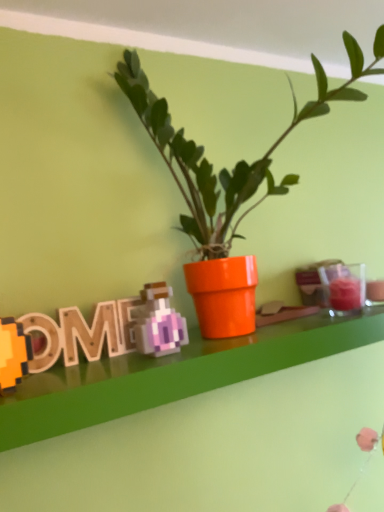
Find the location of a particular element. This screenshot has width=384, height=512. orange glossy pot at center is located at coordinates (239, 161).

This screenshot has height=512, width=384. What do you see at coordinates (239, 161) in the screenshot?
I see `orange glossy pot at center` at bounding box center [239, 161].

You are a GUI agent. You are given a task and a screenshot of the screen. Output one action in this format:
    pyautogui.click(x=<x>, y=<y>)
    Task: Click on the wooden pixelated letter at left
    This screenshot has width=384, height=512.
    Given the screenshot: What is the action you would take?
    pyautogui.click(x=82, y=333)

What do you see at coordinates (82, 333) in the screenshot?
I see `wooden pixelated letter at left` at bounding box center [82, 333].

Locate an element on the screen. This screenshot has height=512, width=384. orange glossy pot at center is located at coordinates 239,161.

Between orange glossy pot at center and wooden pixelated letter at left, which one appears on the left side from the viewer's perspective?

Positioned to the left is wooden pixelated letter at left.

Considering their positions, is orange glossy pot at center located in front of or behind wooden pixelated letter at left?

Clearly, orange glossy pot at center is in front of wooden pixelated letter at left.

Which point is more distant from viewer, (x=163, y=142) or (x=42, y=328)?

Point (x=163, y=142)

From the picture: From the image's perspective, who appears lower, orange glossy pot at center or wooden pixelated letter at left?

wooden pixelated letter at left is shown below in the image.

From a real-world perspective, is orange glossy pot at center positioned above or below wooden pixelated letter at left?

orange glossy pot at center is situated higher than wooden pixelated letter at left in the real world.

Which object is thinner, orange glossy pot at center or wooden pixelated letter at left?

wooden pixelated letter at left.

Which of these two, orange glossy pot at center or wooden pixelated letter at left, stands taller?

Standing taller between the two is orange glossy pot at center.

Which of these two, orange glossy pot at center or wooden pixelated letter at left, is smaller?

Smaller between the two is wooden pixelated letter at left.

Is orange glossy pot at center located outside wooden pixelated letter at left?

That's correct, orange glossy pot at center is outside of wooden pixelated letter at left.

Is orange glossy pot at center not close to wooden pixelated letter at left?

No, orange glossy pot at center is in close proximity to wooden pixelated letter at left.

Could you tell me if orange glossy pot at center is facing wooden pixelated letter at left?

No, orange glossy pot at center does not turn towards wooden pixelated letter at left.

How many degrees apart are the facing directions of orange glossy pot at center and wooden pixelated letter at left?

0.00119 degrees.

Find the location of `houseplant located in front of the wooden pixelated letter at left`. houseplant located in front of the wooden pixelated letter at left is located at coordinates (239, 161).

Does wooden pixelated letter at left appear on the left side of orange glossy pot at center?

Indeed, wooden pixelated letter at left is positioned on the left side of orange glossy pot at center.

Which is behind, wooden pixelated letter at left or orange glossy pot at center?

Positioned behind is wooden pixelated letter at left.

Which point is more distant from viewer, (78, 313) or (166, 114)?

The point (166, 114) is farther from the camera.

From the image's perspective, who appears lower, wooden pixelated letter at left or orange glossy pot at center?

wooden pixelated letter at left is shown below in the image.

From a real-world perspective, is wooden pixelated letter at left over orange glossy pot at center?

Actually, wooden pixelated letter at left is physically below orange glossy pot at center in the real world.

Is wooden pixelated letter at left wider than orange glossy pot at center?

In fact, wooden pixelated letter at left might be narrower than orange glossy pot at center.

In terms of height, does wooden pixelated letter at left look taller or shorter compared to orange glossy pot at center?

Clearly, wooden pixelated letter at left is shorter compared to orange glossy pot at center.

Who is smaller, wooden pixelated letter at left or orange glossy pot at center?

wooden pixelated letter at left.

Would you say wooden pixelated letter at left is inside or outside orange glossy pot at center?

wooden pixelated letter at left is not inside orange glossy pot at center, it's outside.

Is wooden pixelated letter at left next to orange glossy pot at center?

No.

Is wooden pixelated letter at left positioned with its back to orange glossy pot at center?

No, wooden pixelated letter at left is not facing the opposite direction of orange glossy pot at center.

Identify the location of alphabet that appears below the orange glossy pot at center (from a real-world perspective). (82, 333).

Find the location of a particular element. houseplant above the wooden pixelated letter at left (from a real-world perspective) is located at coordinates (239, 161).

The width and height of the screenshot is (384, 512). I want to click on alphabet lying below the orange glossy pot at center (from the image's perspective), so click(82, 333).